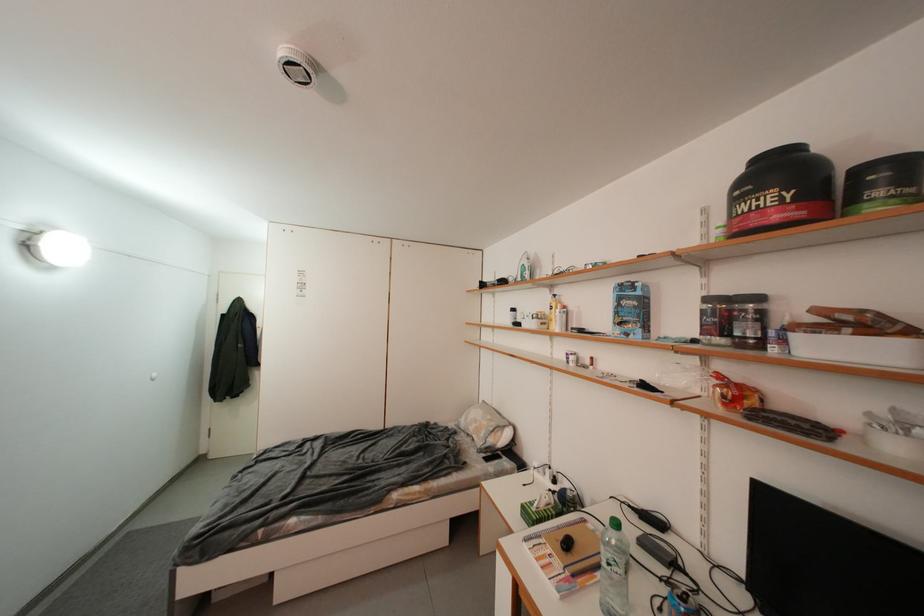
The height and width of the screenshot is (616, 924). In order to click on creatine container lid in this screenshot , I will do `click(777, 152)`.